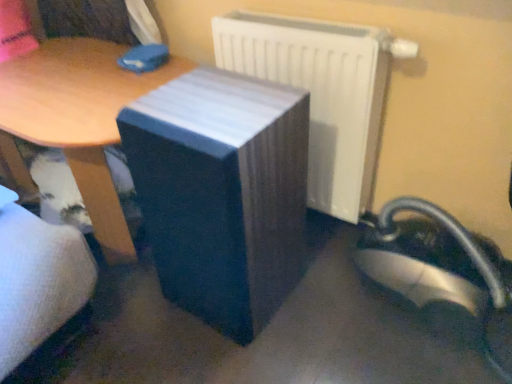
Question: From a real-world perspective, is white glossy radiator at upper right physically above wooden table at center, acting as the second table starting from the right?

Choices:
 (A) yes
 (B) no

Answer: (A)

Question: Does white glossy radiator at upper right turn towards wooden table at center, acting as the second table starting from the right?

Choices:
 (A) no
 (B) yes

Answer: (A)

Question: Is white glossy radiator at upper right smaller than wooden table at center, acting as the second table starting from the right?

Choices:
 (A) no
 (B) yes

Answer: (B)

Question: Is white glossy radiator at upper right bigger than wooden table at center, acting as the second table starting from the right?

Choices:
 (A) yes
 (B) no

Answer: (B)

Question: From a real-world perspective, is white glossy radiator at upper right positioned under wooden table at center, arranged as the 1th table when viewed from the left, based on gravity?

Choices:
 (A) no
 (B) yes

Answer: (A)

Question: Can you confirm if white glossy radiator at upper right is taller than wooden table at center, acting as the second table starting from the right?

Choices:
 (A) yes
 (B) no

Answer: (A)

Question: Is white glossy radiator at upper right to the left of matte black speaker at center, which is counted as the 1th table, starting from the right, from the viewer's perspective?

Choices:
 (A) no
 (B) yes

Answer: (A)

Question: Considering the relative positions of white glossy radiator at upper right and matte black speaker at center, which is counted as the 1th table, starting from the right, in the image provided, is white glossy radiator at upper right behind matte black speaker at center, which is counted as the 1th table, starting from the right,?

Choices:
 (A) yes
 (B) no

Answer: (A)

Question: Does white glossy radiator at upper right have a larger size compared to matte black speaker at center, which is the second table from left to right?

Choices:
 (A) yes
 (B) no

Answer: (B)

Question: Is white glossy radiator at upper right positioned with its back to matte black speaker at center, which is the second table from left to right?

Choices:
 (A) no
 (B) yes

Answer: (B)

Question: From the image's perspective, does white glossy radiator at upper right appear higher than matte black speaker at center, which is the second table from left to right?

Choices:
 (A) yes
 (B) no

Answer: (A)

Question: Considering the relative sizes of white glossy radiator at upper right and matte black speaker at center, which is counted as the 1th table, starting from the right, in the image provided, is white glossy radiator at upper right wider than matte black speaker at center, which is counted as the 1th table, starting from the right,?

Choices:
 (A) yes
 (B) no

Answer: (B)

Question: Does wooden table at center, acting as the second table starting from the right, touch white glossy radiator at upper right?

Choices:
 (A) yes
 (B) no

Answer: (B)